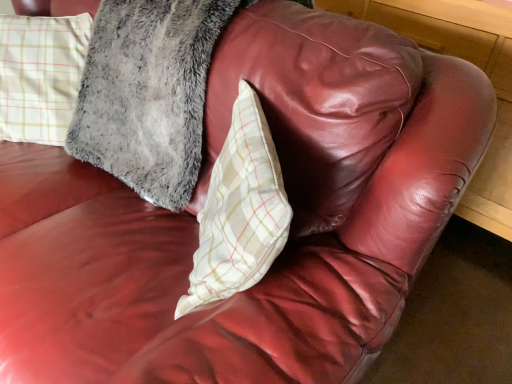
Question: Could you tell me if white plaid pillow at center, the first pillow when ordered from right to left, is turned towards plaid fabric pillow at upper left, arranged as the first pillow when viewed from the left?

Choices:
 (A) yes
 (B) no

Answer: (B)

Question: Does white plaid pillow at center, the first pillow when ordered from right to left, have a larger size compared to plaid fabric pillow at upper left, the second pillow from the right?

Choices:
 (A) no
 (B) yes

Answer: (A)

Question: Is white plaid pillow at center, the first pillow when ordered from right to left, beside plaid fabric pillow at upper left, arranged as the first pillow when viewed from the left?

Choices:
 (A) yes
 (B) no

Answer: (B)

Question: Is white plaid pillow at center, marked as the second pillow in a left-to-right arrangement, surrounding plaid fabric pillow at upper left, arranged as the first pillow when viewed from the left?

Choices:
 (A) yes
 (B) no

Answer: (B)

Question: Considering the relative sizes of white plaid pillow at center, marked as the second pillow in a left-to-right arrangement, and plaid fabric pillow at upper left, the second pillow from the right, in the image provided, is white plaid pillow at center, marked as the second pillow in a left-to-right arrangement, wider than plaid fabric pillow at upper left, the second pillow from the right,?

Choices:
 (A) no
 (B) yes

Answer: (A)

Question: Can you confirm if white plaid pillow at center, the first pillow when ordered from right to left, is positioned to the right of plaid fabric pillow at upper left, arranged as the first pillow when viewed from the left?

Choices:
 (A) yes
 (B) no

Answer: (A)

Question: Is plaid fabric pillow at upper left, the second pillow from the right, positioned with its back to white plaid pillow at center, marked as the second pillow in a left-to-right arrangement?

Choices:
 (A) yes
 (B) no

Answer: (B)

Question: From a real-world perspective, is plaid fabric pillow at upper left, the second pillow from the right, over white plaid pillow at center, the first pillow when ordered from right to left?

Choices:
 (A) yes
 (B) no

Answer: (A)

Question: Is white plaid pillow at center, the first pillow when ordered from right to left, completely or partially inside plaid fabric pillow at upper left, the second pillow from the right?

Choices:
 (A) yes
 (B) no

Answer: (B)

Question: Is plaid fabric pillow at upper left, the second pillow from the right, bigger than white plaid pillow at center, the first pillow when ordered from right to left?

Choices:
 (A) no
 (B) yes

Answer: (B)

Question: Is plaid fabric pillow at upper left, arranged as the first pillow when viewed from the left, placed right next to white plaid pillow at center, marked as the second pillow in a left-to-right arrangement?

Choices:
 (A) no
 (B) yes

Answer: (A)

Question: Can you confirm if plaid fabric pillow at upper left, arranged as the first pillow when viewed from the left, is smaller than white plaid pillow at center, marked as the second pillow in a left-to-right arrangement?

Choices:
 (A) yes
 (B) no

Answer: (B)

Question: From the image's perspective, relative to plaid fabric pillow at upper left, the second pillow from the right, is white plaid pillow at center, marked as the second pillow in a left-to-right arrangement, above or below?

Choices:
 (A) above
 (B) below

Answer: (B)